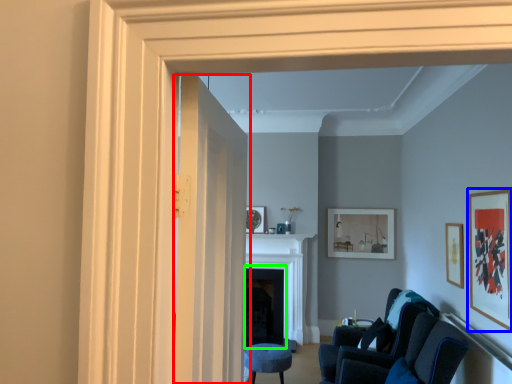
Question: Which object is positioned closest to door (highlighted by a red box)? Select from picture frame (highlighted by a blue box) and fireplace (highlighted by a green box).

Choices:
 (A) picture frame
 (B) fireplace

Answer: (A)